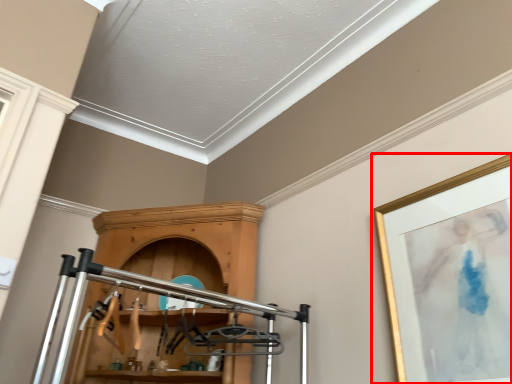
Question: Considering the relative positions of picture frame (annotated by the red box) and furniture in the image provided, where is picture frame (annotated by the red box) located with respect to the staircase?

Choices:
 (A) left
 (B) right

Answer: (B)